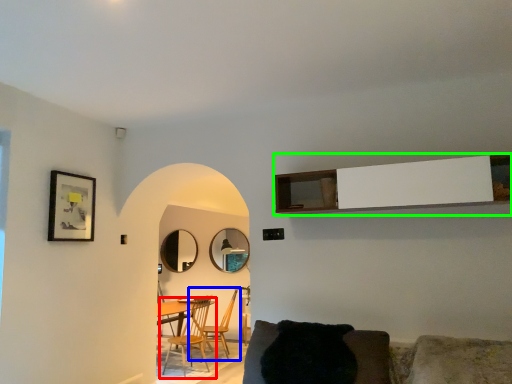
Question: Considering the real-world distances, which object is closest to chair (highlighted by a red box)? chair (highlighted by a blue box) or cabinetry (highlighted by a green box).

Choices:
 (A) chair
 (B) cabinetry

Answer: (A)